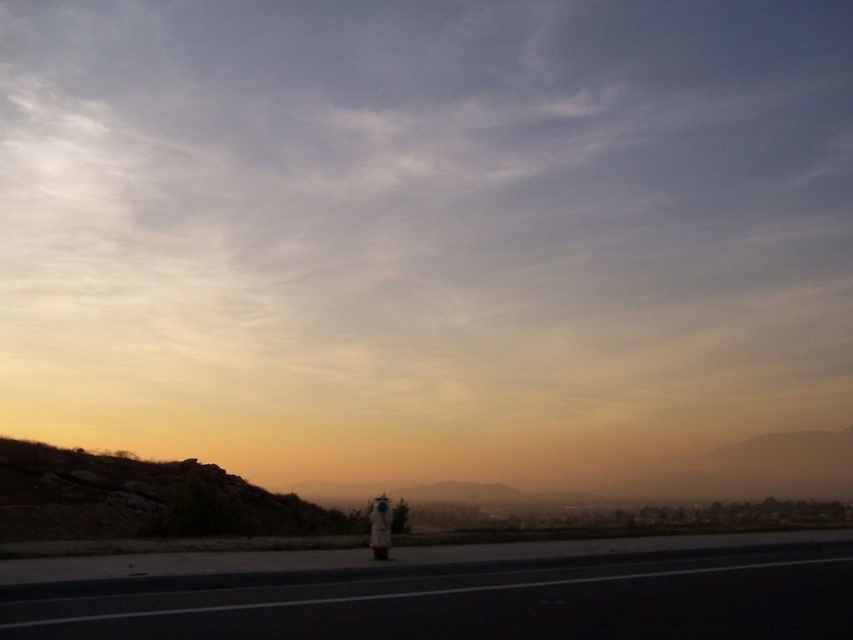
Based on the photo, you are a photographer trying to capture the white fabric person at lower center and the dull brown rock at lower left in the same frame. Which object is wider?

The dull brown rock at lower left is wider than the white fabric person at lower center.

You are a photographer trying to capture the scene. You want to ensure that both the dull brown rock at lower left and the white fabric person at lower center are clearly visible in your photo. Given their height difference, which object might require you to adjust your camera angle more significantly to include it fully in the frame?

The dull brown rock at lower left is much taller than the white fabric person at lower center, so you might need to adjust your camera angle more significantly to include the dull brown rock at lower left fully in the frame.

You are a drone operator who needs to capture aerial footage of the black asphalt highway at lower center. According to the coordinates provided, where exactly should you position the drone to ensure it is directly above the highway?

The black asphalt highway at lower center is located at coordinates point (448, 592), so positioning the drone directly above this point will ensure it captures the highway accurately.